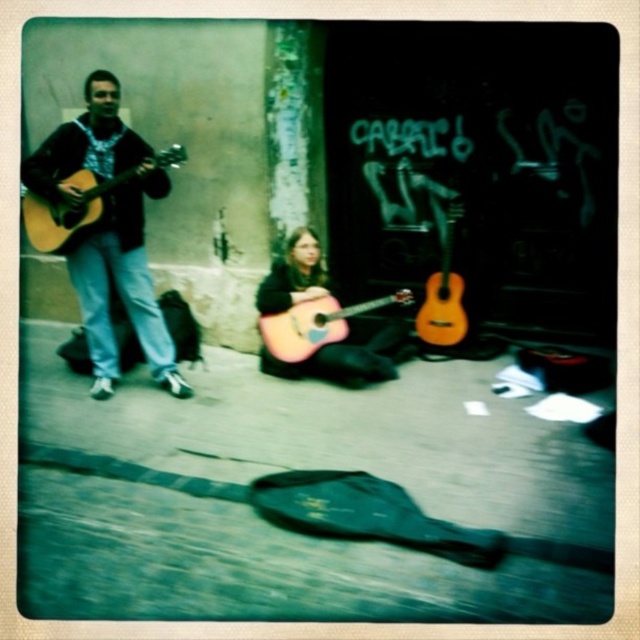
Question: Can you confirm if matte acoustic guitar at left is bigger than acoustic wood guitar at center?

Choices:
 (A) no
 (B) yes

Answer: (B)

Question: Which point appears farthest from the camera in this image?

Choices:
 (A) (77, 221)
 (B) (145, 321)
 (C) (44, 518)

Answer: (B)

Question: Can you confirm if smooth concrete pavement at center is positioned to the right of matte black guitar at left?

Choices:
 (A) no
 (B) yes

Answer: (B)

Question: Is matte black guitar at left to the right of matte acoustic guitar at left from the viewer's perspective?

Choices:
 (A) yes
 (B) no

Answer: (A)

Question: Which point is closer to the camera?

Choices:
 (A) wooden acoustic guitar at center
 (B) matte acoustic guitar at left
 (C) acoustic wood guitar at center
 (D) matte black guitar at left

Answer: (B)

Question: Which of the following is the closest to the observer?

Choices:
 (A) (x=93, y=224)
 (B) (x=424, y=342)
 (C) (x=355, y=305)
 (D) (x=394, y=326)

Answer: (A)